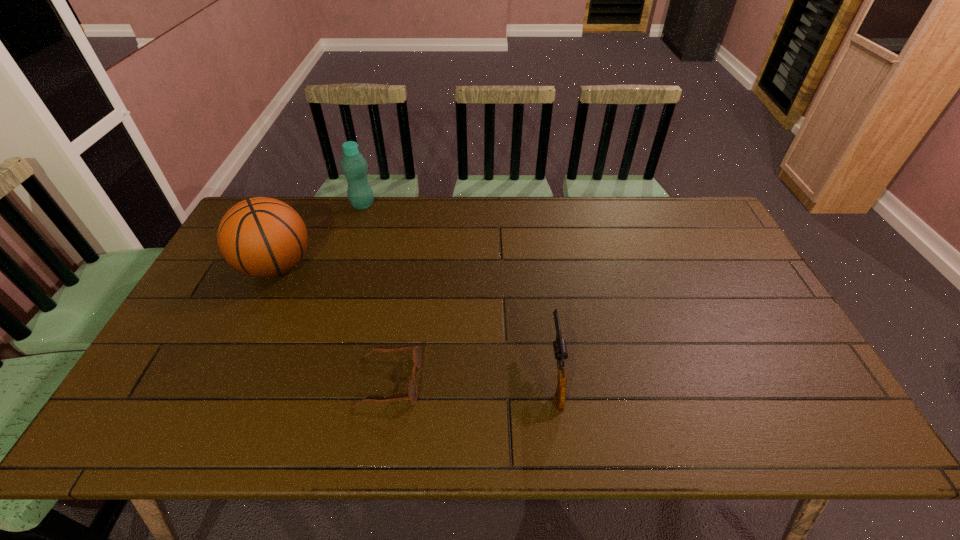
Where is `water bottle`? water bottle is located at coordinates (354, 166).

The image size is (960, 540). Identify the location of the farthest object. (354, 166).

You are a GUI agent. You are given a task and a screenshot of the screen. Output one action in this format:
    pyautogui.click(x=<x>, y=<y>)
    Task: Click on the third nearest object
    Image resolution: width=960 pixels, height=540 pixels.
    Given the screenshot: What is the action you would take?
    pyautogui.click(x=261, y=237)

Locate an element on the screen. The width and height of the screenshot is (960, 540). basketball is located at coordinates (261, 237).

The height and width of the screenshot is (540, 960). What are the coordinates of `gun` in the screenshot? It's located at (560, 349).

This screenshot has height=540, width=960. In order to click on the second shortest object in this screenshot , I will do point(560,349).

Locate an element on the screen. This screenshot has width=960, height=540. the shortest object is located at coordinates (412, 389).

Identify the location of the second object from right to left. (412, 389).

Locate an element on the screen. vacant space located 0.240m at the front cap of the second object from left to right is located at coordinates (443, 205).

Where is `vacant space located 0.360m on the right of the leftmost object`? The width and height of the screenshot is (960, 540). vacant space located 0.360m on the right of the leftmost object is located at coordinates (432, 266).